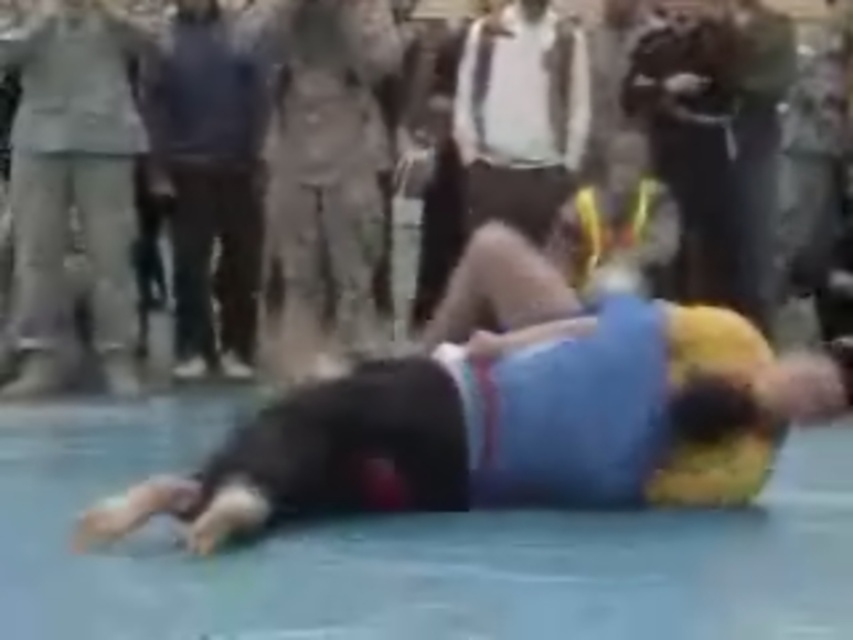
You are a photographer at the event and want to capture both the blue fabric wrestler at center and the khaki fabric jacket at upper center in the same frame. Which object should you position your camera closer to in order to include both subjects without zooming out?

To capture both the blue fabric wrestler at center and the khaki fabric jacket at upper center in the same frame without zooming out, position your camera closer to the khaki fabric jacket at upper center since the blue fabric wrestler at center is to the right of it, allowing you to frame them both by centering the khaki jacket and adjusting the angle to include the wrestler on the right side.